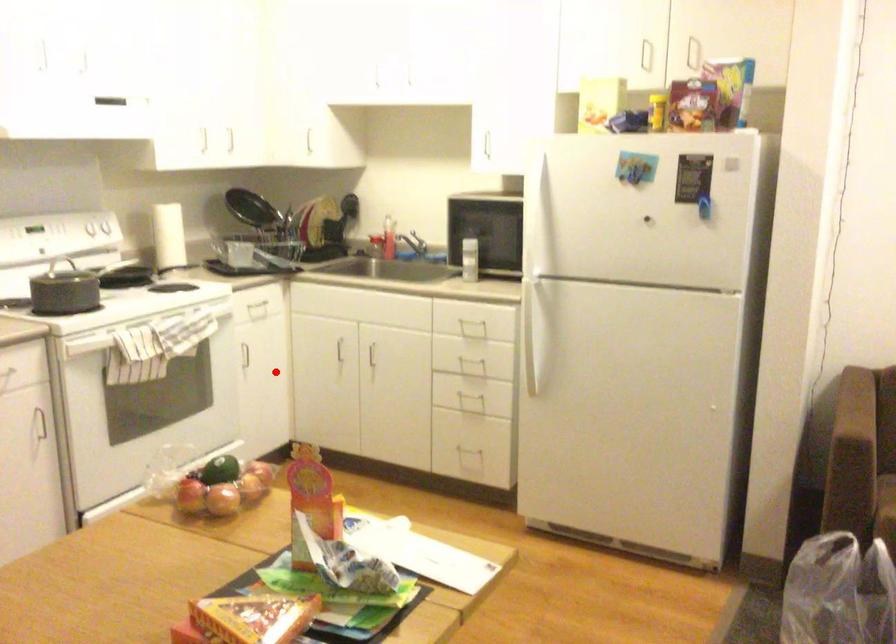
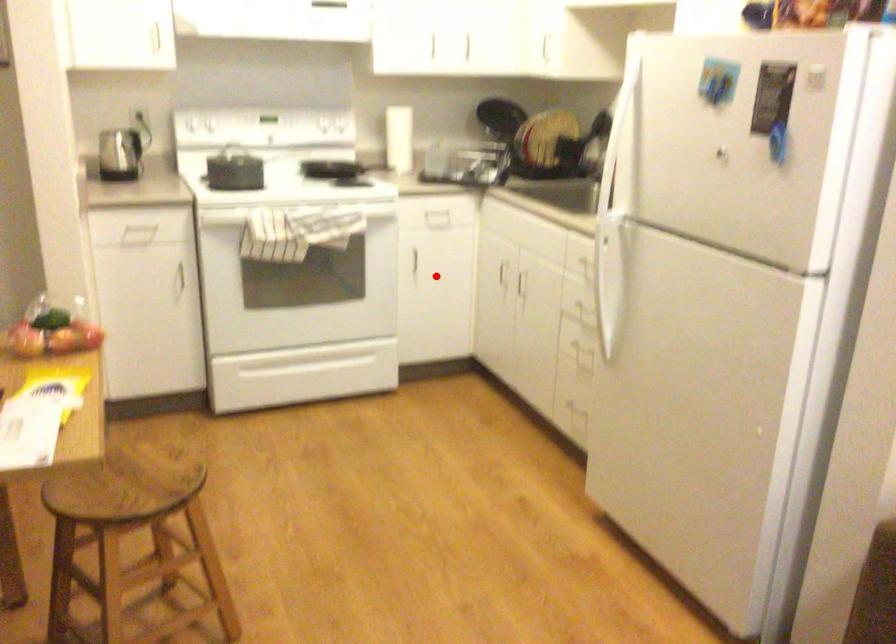
I am providing you with two images of the same scene from different viewpoints. A red point is marked on the first image and another point is marked on the second image. Does the point marked in image1 correspond to the same location as the one in image2?

Yes